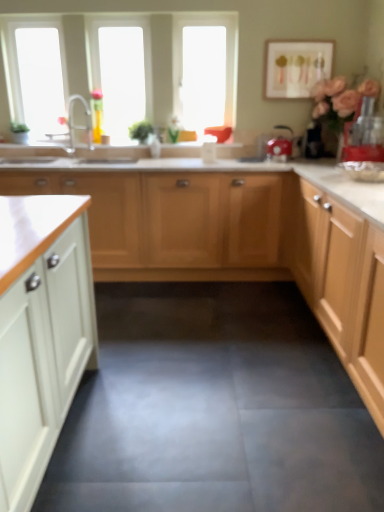
Where is `vacant space situated above transparent plastic window screen at upper center, the 1th window screen positioned from the right (from a real-world perspective)`? vacant space situated above transparent plastic window screen at upper center, the 1th window screen positioned from the right (from a real-world perspective) is located at coordinates pos(202,15).